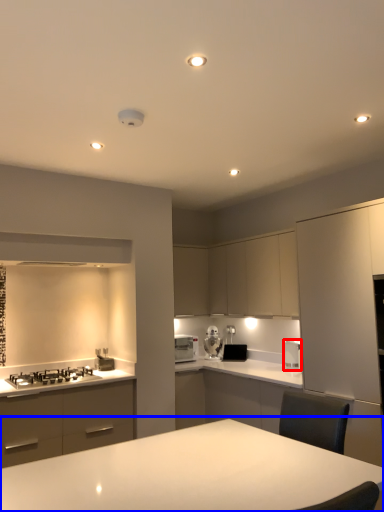
Question: Which of the following is the closest to the observer, kitchen appliance (highlighted by a red box) or table (highlighted by a blue box)?

Choices:
 (A) kitchen appliance
 (B) table

Answer: (B)